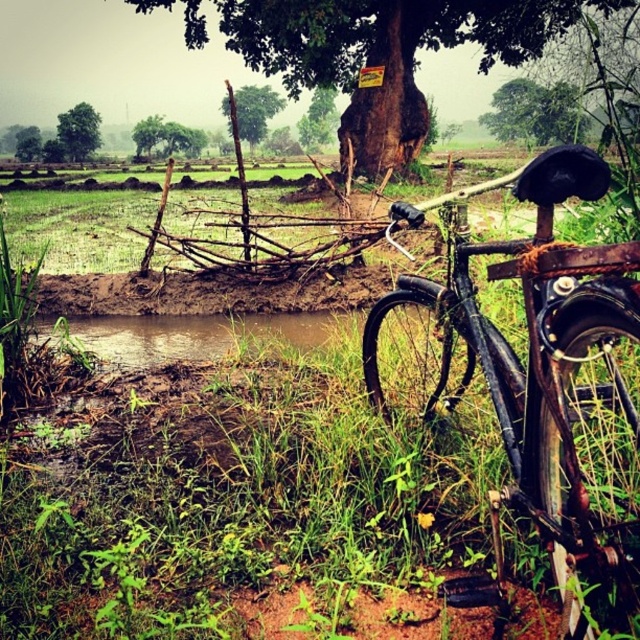
You are planning to hang a birdhouse on one of the trees in the scene. Which tree, the brown rough tree at center or the green rough bark tree at upper center, would you choose if you want the birdhouse to be higher up?

The brown rough tree at center is taller than the green rough bark tree at upper center, so you should choose the brown rough tree at center to place the birdhouse higher up.

You are a painter setting up an easel to paint the scene. You want to ensure that the rusty metal bicycle at right and the green leafy tree at upper center are both visible in your painting. Given their relative sizes, which object should you place closer to the center of your canvas to maintain balance?

The rusty metal bicycle at right has a lesser width compared to the green leafy tree at upper center. To balance their sizes, you should place the rusty metal bicycle at right closer to the center of the canvas so it appears larger in the composition, while the green leafy tree at upper center can be positioned slightly off center to account for its greater width.